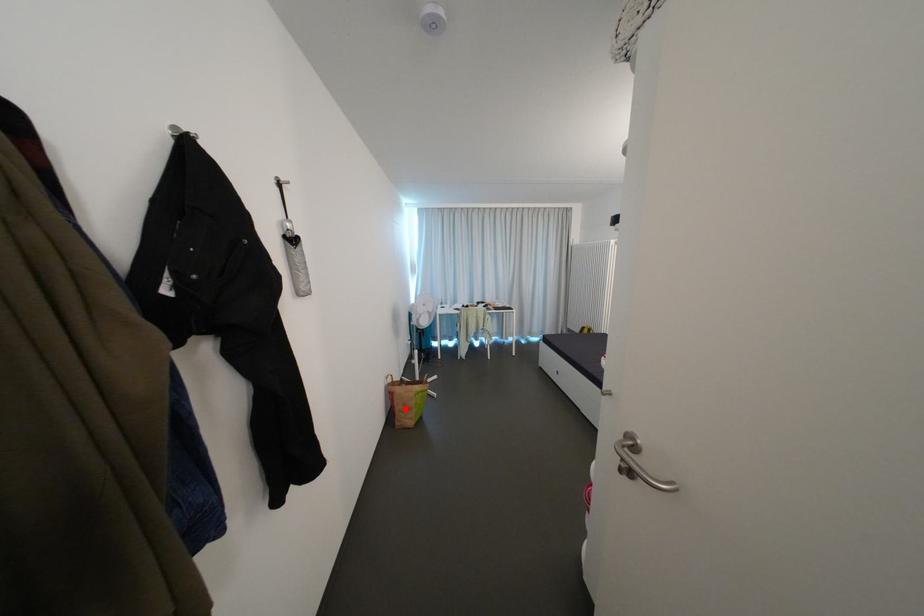
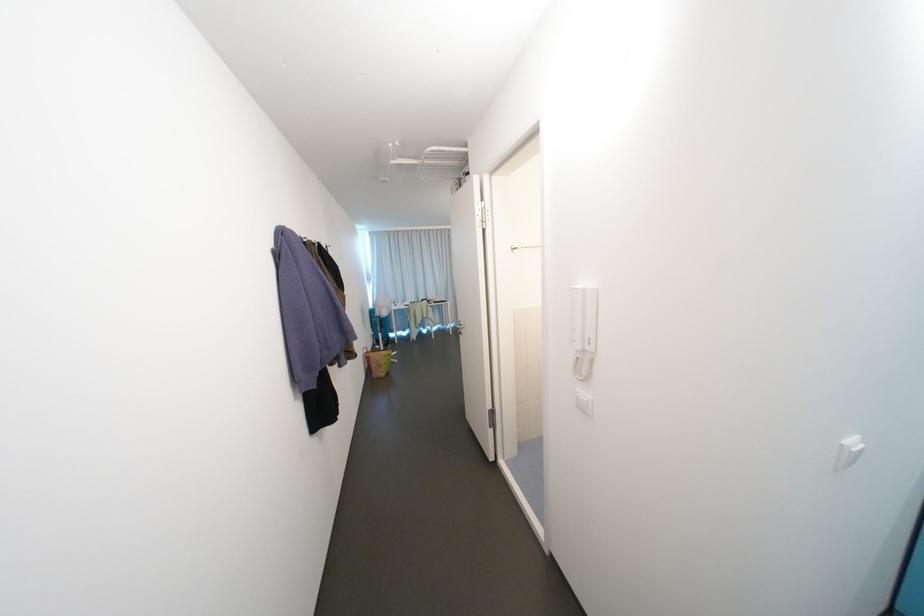
Locate, in the second image, the point that corresponds to the highlighted location in the first image.

(381, 367)